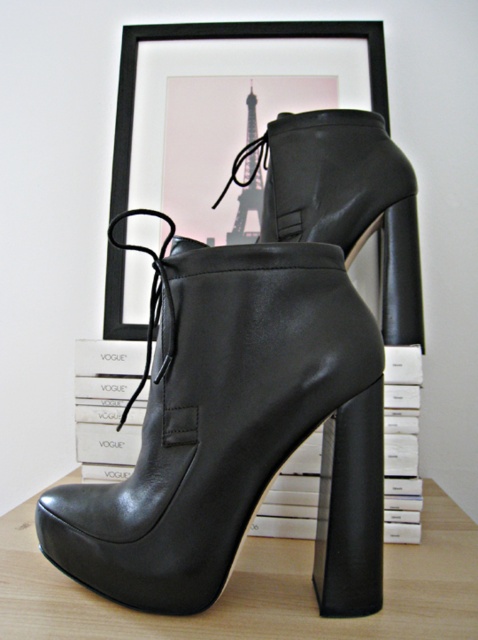
Question: In this image, where is black leather platform boot at lower center located relative to black matte picture frame at upper center?

Choices:
 (A) above
 (B) below

Answer: (B)

Question: Based on their relative distances, which object is nearer to the black leather platform boot at lower center?

Choices:
 (A) black leather boot at center
 (B) black matte picture frame at upper center

Answer: (A)

Question: From the image, what is the correct spatial relationship of black leather platform boot at lower center in relation to black matte picture frame at upper center?

Choices:
 (A) above
 (B) below

Answer: (B)

Question: Which of the following is the farthest from the observer?

Choices:
 (A) black leather boot at center
 (B) black matte picture frame at upper center

Answer: (B)

Question: Observing the image, what is the correct spatial positioning of black leather platform boot at lower center in reference to black matte picture frame at upper center?

Choices:
 (A) left
 (B) right

Answer: (B)

Question: Considering the real-world distances, which object is closest to the black leather boot at center?

Choices:
 (A) black leather platform boot at lower center
 (B) black matte picture frame at upper center

Answer: (A)